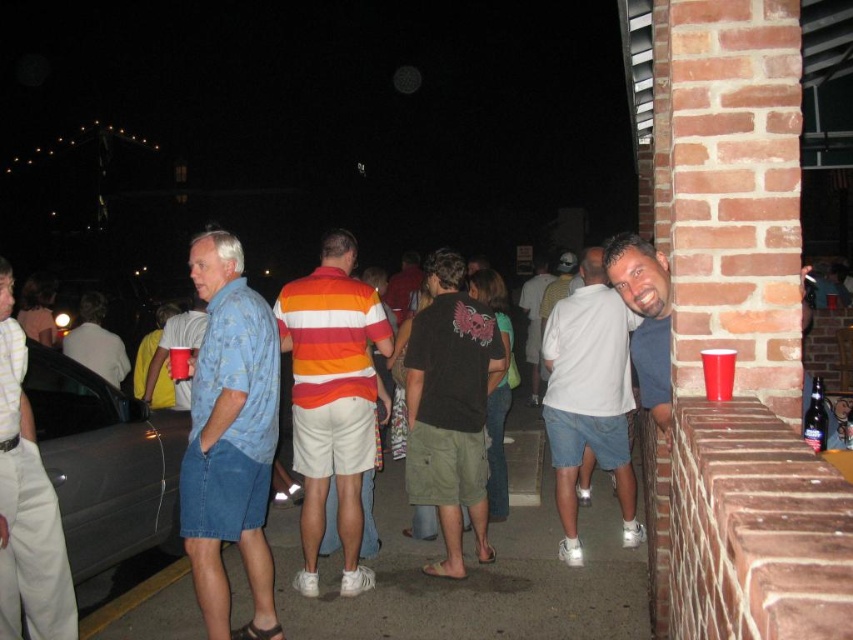
Who is shorter, brushed metal shirt at left or matte white t-shirt at center?

matte white t-shirt at center

Image resolution: width=853 pixels, height=640 pixels. Find the location of `brushed metal shirt at left`. brushed metal shirt at left is located at coordinates (26, 502).

Find the location of a particular element. Image resolution: width=853 pixels, height=640 pixels. brushed metal shirt at left is located at coordinates (26, 502).

Does blue denim shorts at left appear on the right side of orange striped polo shirt at center?

Incorrect, blue denim shorts at left is not on the right side of orange striped polo shirt at center.

Is blue denim shorts at left behind orange striped polo shirt at center?

That is False.

Which is behind, point (268, 371) or point (309, 387)?

The point (309, 387) is behind.

This screenshot has width=853, height=640. I want to click on blue denim shorts at left, so click(x=230, y=438).

Who is lower down, matte blue t-shirt at right or matte white t-shirt at center?

matte white t-shirt at center is below.

The image size is (853, 640). Describe the element at coordinates (645, 317) in the screenshot. I see `matte blue t-shirt at right` at that location.

Locate an element on the screen. This screenshot has width=853, height=640. matte blue t-shirt at right is located at coordinates (645, 317).